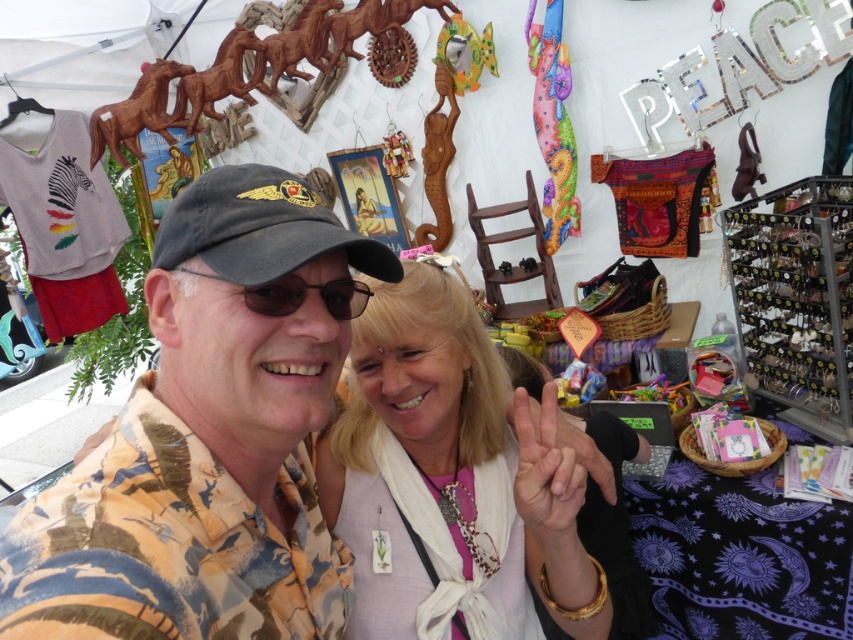
Question: Which object is closer to the camera taking this photo?

Choices:
 (A) white fabric scarf at center
 (B) black fabric baseball cap at center

Answer: (B)

Question: Among these objects, which one is nearest to the camera?

Choices:
 (A) black fabric baseball cap at center
 (B) printed cotton shirt at center

Answer: (B)

Question: Can you confirm if black fabric baseball cap at center is wider than black plastic goggles at center?

Choices:
 (A) no
 (B) yes

Answer: (B)

Question: Does white fabric scarf at center appear on the left side of black fabric baseball cap at center?

Choices:
 (A) no
 (B) yes

Answer: (A)

Question: Which object is positioned farthest from the black fabric baseball cap at center?

Choices:
 (A) white fabric scarf at center
 (B) black plastic goggles at center

Answer: (A)

Question: Does white fabric scarf at center appear over black plastic goggles at center?

Choices:
 (A) no
 (B) yes

Answer: (A)